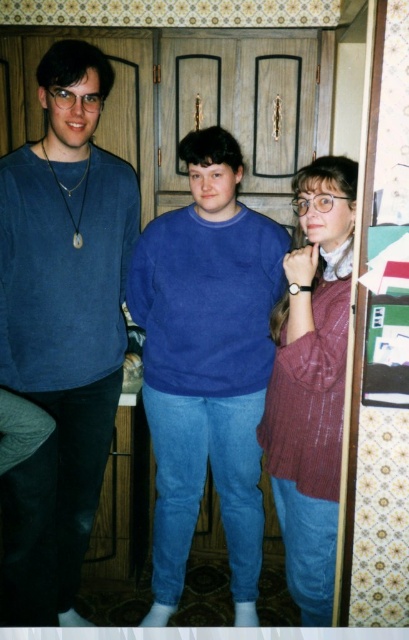
You are organizing a clothing donation drive and need to stack the matte blue sweater at left and the blue cotton sweater at center vertically. Given that the space available is limited in height, which sweater should you place at the bottom to ensure both fit within the height constraint?

The matte blue sweater at left is located above the blue cotton sweater at center, so placing the blue cotton sweater at center at the bottom would allow both to fit within the height constraint since the matte blue sweater at left is positioned higher up.

You are trying to decide which sweater to wear for a casual day out. Both the blue cotton sweater at center and the knitted maroon sweater at center are options. Which one has a wider fit?

The blue cotton sweater at center has a larger width than the knitted maroon sweater at center, so it offers a wider fit.

You are a photographer holding a camera. You want to take a photo of the blue cotton sweater at center from a distance that ensures the sweater is in focus. If your camera has a minimum focusing distance of 1.5 meters, can you successfully take the photo without moving closer?

The camera and blue cotton sweater at center are 1.72 meters apart. Since the minimum focusing distance is 1.5 meters, the photographer can take the photo successfully as the distance is sufficient.